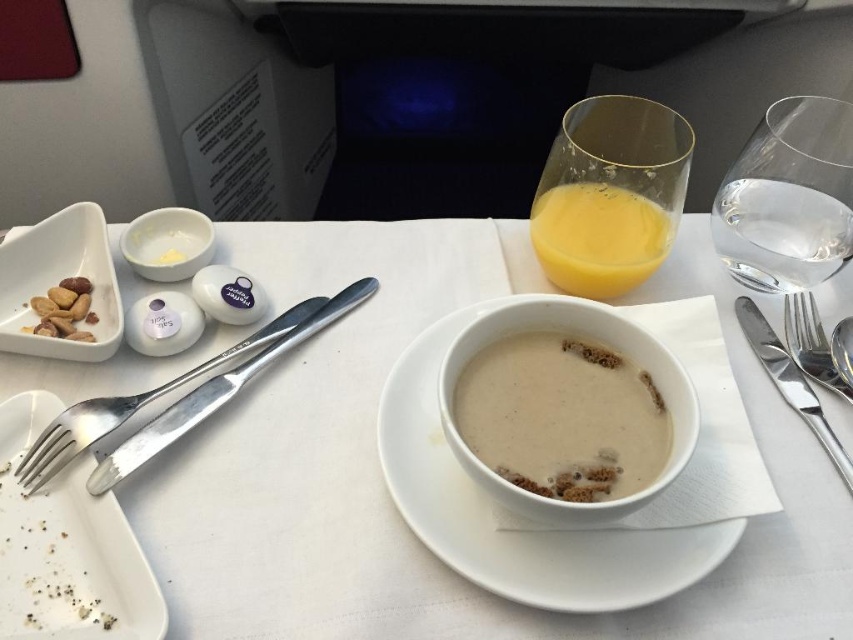
You are a flight attendant checking the meal tray for proper placement. The airline requires that all drinks must be placed within 30 centimeters from the camera to ensure passenger access. Is the translucent glass of orange juice at upper right compliant with this requirement?

The translucent glass of orange juice at upper right is 36.05 centimeters from the camera, which exceeds the 30 centimeter requirement. Therefore, it is not compliant with the airline regulation.

You are a flight attendant checking the meal tray. The airline requires that the clear glass water at upper right and the white glossy bowl at upper left must be placed in a specific order based on their sizes. According to the size comparison, which item should be placed first in the tray from the passenger?

The clear glass water at upper right is larger in size than the white glossy bowl at upper left, so the clear glass water at upper right should be placed first in the tray from the passenger to accommodate its larger size.

You are a flight attendant checking the meal tray. You notice the translucent glass of orange juice at upper right and the satin silver spoon at right. Which item is positioned higher on the tray?

The translucent glass of orange juice at upper right is positioned higher on the tray than the satin silver spoon at right.